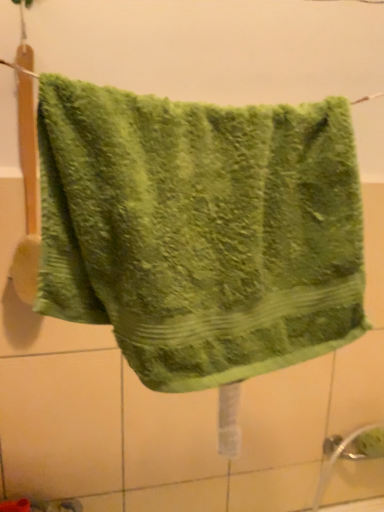
Question: Choose the correct answer: Is green fluffy towel at center inside white matte tile at lower left or outside it?

Choices:
 (A) outside
 (B) inside

Answer: (A)

Question: Relative to white matte tile at lower left, is green fluffy towel at center in front or behind?

Choices:
 (A) front
 (B) behind

Answer: (A)

Question: Based on their positions, is green fluffy towel at center located to the left or right of white matte tile at lower left?

Choices:
 (A) left
 (B) right

Answer: (B)

Question: In terms of size, does white matte tile at lower left appear bigger or smaller than green fluffy towel at center?

Choices:
 (A) small
 (B) big

Answer: (A)

Question: Relative to green fluffy towel at center, is white matte tile at lower left in front or behind?

Choices:
 (A) behind
 (B) front

Answer: (A)

Question: In terms of width, does white matte tile at lower left look wider or thinner when compared to green fluffy towel at center?

Choices:
 (A) thin
 (B) wide

Answer: (A)

Question: Is white matte tile at lower left situated inside green fluffy towel at center or outside?

Choices:
 (A) inside
 (B) outside

Answer: (B)